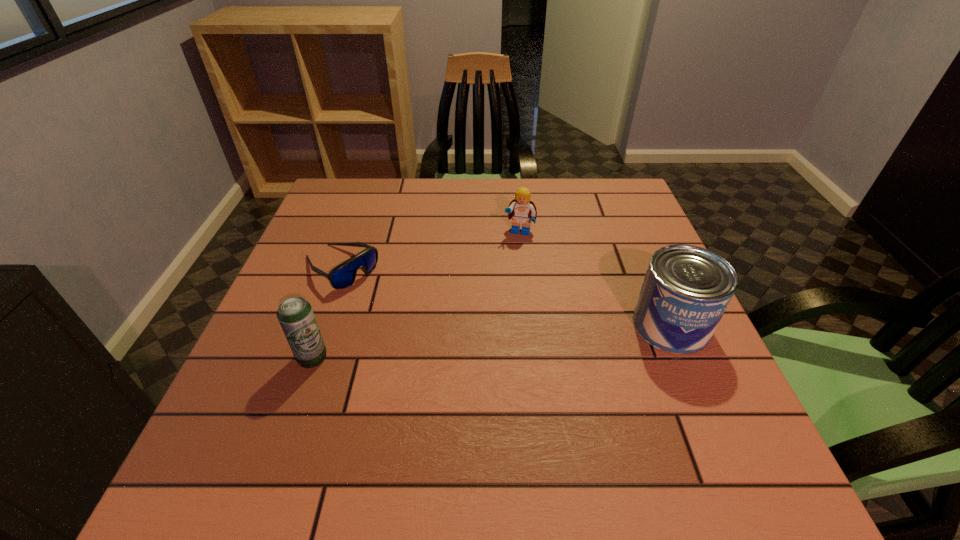
Locate an element on the screen. This screenshot has height=540, width=960. vacant region located 0.230m on the front-facing side of the sunglasses is located at coordinates (436, 333).

At what (x,y) coordinates should I click in order to perform the action: click on vacant space situated 0.070m on the front-facing side of the sunglasses. Please return your answer as a coordinate pair (x, y). Looking at the image, I should click on [x=385, y=298].

Image resolution: width=960 pixels, height=540 pixels. In order to click on vacant space located on the front-facing side of the sunglasses in this screenshot , I will do `click(388, 300)`.

Where is `beer can that is at the left edge`? The width and height of the screenshot is (960, 540). beer can that is at the left edge is located at coordinates (295, 315).

Locate an element on the screen. sunglasses present at the left edge is located at coordinates (342, 276).

In order to click on object at the right edge in this screenshot , I will do 686,290.

Find the location of a particular element. The height and width of the screenshot is (540, 960). free space at the far edge of the desktop is located at coordinates (435, 222).

Locate an element on the screen. This screenshot has width=960, height=540. vacant space at the near edge of the desktop is located at coordinates (500, 400).

In the image, there is a desktop. At what (x,y) coordinates should I click in order to perform the action: click on vacant space at the left edge. Please return your answer as a coordinate pair (x, y). This screenshot has height=540, width=960. Looking at the image, I should click on (276, 381).

Where is `vacant space at the right edge of the desktop`? This screenshot has width=960, height=540. vacant space at the right edge of the desktop is located at coordinates (612, 274).